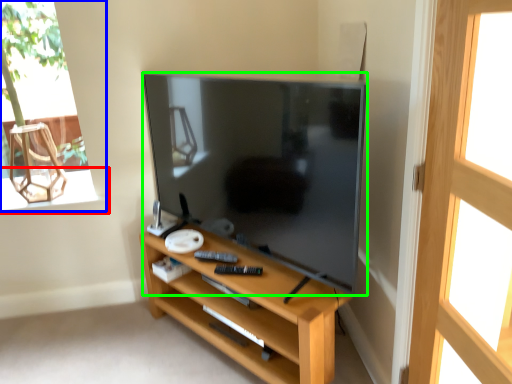
Question: Which object is the closest to the window sill (highlighted by a red box)? Choose among these: window (highlighted by a blue box) or television (highlighted by a green box).

Choices:
 (A) window
 (B) television

Answer: (A)